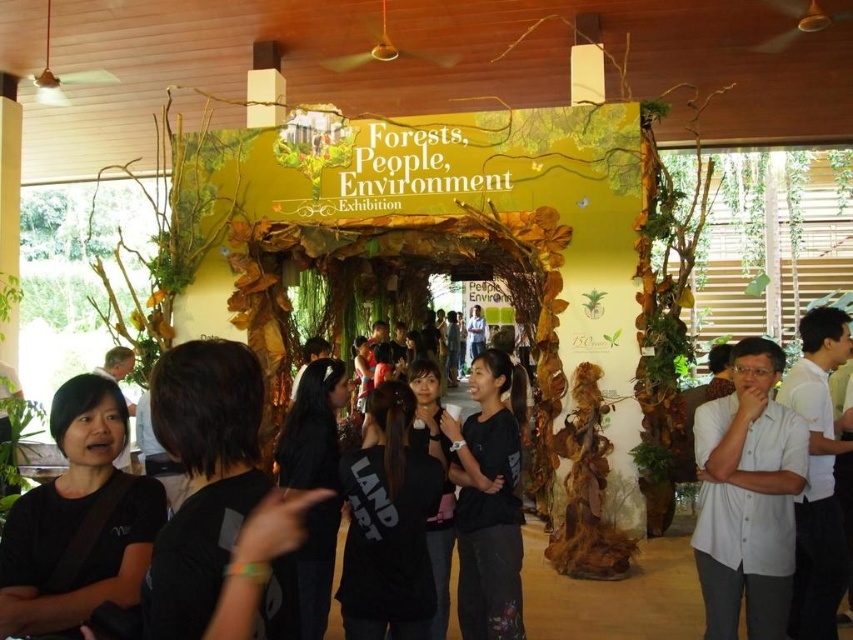
Question: Which point is farther to the camera?

Choices:
 (A) pos(816,440)
 (B) pos(733,497)
 (C) pos(148,554)

Answer: (A)

Question: Estimate the real-world distances between objects in this image. Which object is farther from the white shirt at right?

Choices:
 (A) white shirt at center
 (B) black matte shirt at lower left

Answer: (B)

Question: Does black matte shirt at lower left appear on the left side of white shirt at center?

Choices:
 (A) yes
 (B) no

Answer: (A)

Question: Considering the relative positions of black matte shirt at lower left and white shirt at center in the image provided, where is black matte shirt at lower left located with respect to white shirt at center?

Choices:
 (A) below
 (B) above

Answer: (B)

Question: Which of the following is the closest to the observer?

Choices:
 (A) white shirt at center
 (B) black matte shirt at lower left
 (C) white shirt at right

Answer: (B)

Question: Does white shirt at center appear over white shirt at right?

Choices:
 (A) yes
 (B) no

Answer: (B)